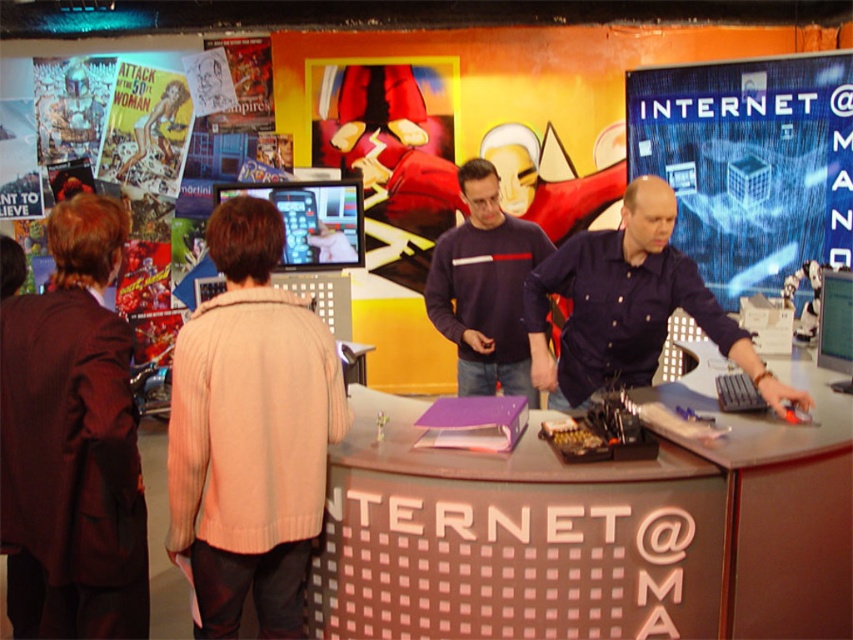
Can you confirm if blue digital screen at right is wider than dark blue shirt at center?

Yes.

Does point (845, 58) come behind point (596, 330)?

Yes, it is.

Between point (837, 164) and point (715, 317), which one is positioned in front?

Positioned in front is point (715, 317).

Locate an element on the screen. This screenshot has height=640, width=853. blue digital screen at right is located at coordinates (749, 163).

Between black plastic information desk at center and dark blue shirt at center, which one appears on the right side from the viewer's perspective?

dark blue shirt at center

Does black plastic information desk at center appear over dark blue shirt at center?

No, black plastic information desk at center is not above dark blue shirt at center.

Who is more forward, (618, 518) or (614, 253)?

Point (618, 518) is in front.

I want to click on black plastic information desk at center, so click(x=590, y=529).

What do you see at coordinates (250, 433) in the screenshot?
I see `beige knitted sweater at center` at bounding box center [250, 433].

Based on the photo, is beige knitted sweater at center below dark brown leather jacket at left?

No, beige knitted sweater at center is not below dark brown leather jacket at left.

Between point (289, 394) and point (126, 568), which one is positioned behind?

The point (289, 394) is more distant.

The width and height of the screenshot is (853, 640). I want to click on beige knitted sweater at center, so click(x=250, y=433).